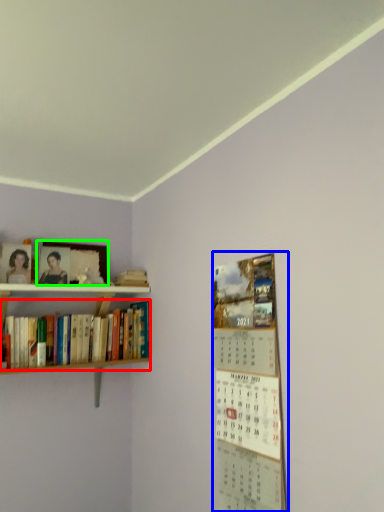
Question: Which object is the farthest from book (highlighted by a red box)? Choose among these: bulletin board (highlighted by a blue box) or picture frame (highlighted by a green box).

Choices:
 (A) bulletin board
 (B) picture frame

Answer: (A)